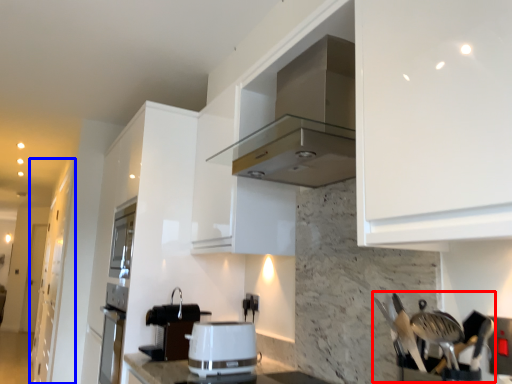
Question: Which object appears farthest to the camera in this image, silverware (highlighted by a red box) or cabinetry (highlighted by a blue box)?

Choices:
 (A) silverware
 (B) cabinetry

Answer: (B)